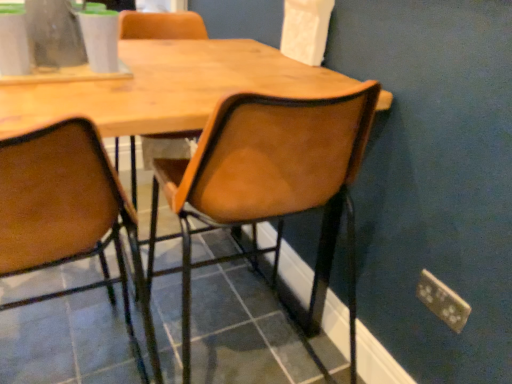
Question: From a real-world perspective, is brown leather chair at center, the second chair positioned from the right, physically above leather-like brown chair at center, which is the 1th chair in right-to-left order?

Choices:
 (A) no
 (B) yes

Answer: (A)

Question: Are brown leather chair at center, which ranks as the first chair in left-to-right order, and leather-like brown chair at center, the second chair viewed from the left, far apart?

Choices:
 (A) no
 (B) yes

Answer: (A)

Question: Is brown leather chair at center, the second chair positioned from the right, positioned before leather-like brown chair at center, which is the 1th chair in right-to-left order?

Choices:
 (A) no
 (B) yes

Answer: (B)

Question: Is brown leather chair at center, which ranks as the first chair in left-to-right order, next to leather-like brown chair at center, which is the 1th chair in right-to-left order?

Choices:
 (A) no
 (B) yes

Answer: (A)

Question: Can you confirm if brown leather chair at center, the second chair positioned from the right, is taller than leather-like brown chair at center, which is the 1th chair in right-to-left order?

Choices:
 (A) yes
 (B) no

Answer: (B)

Question: From a real-world perspective, is brown leather chair at center, the second chair positioned from the right, physically located above or below metallic gold power plugs and sockets at lower right?

Choices:
 (A) below
 (B) above

Answer: (B)

Question: Considering the positions of brown leather chair at center, the second chair positioned from the right, and metallic gold power plugs and sockets at lower right in the image, is brown leather chair at center, the second chair positioned from the right, wider or thinner than metallic gold power plugs and sockets at lower right?

Choices:
 (A) thin
 (B) wide

Answer: (B)

Question: From the image's perspective, is brown leather chair at center, the second chair positioned from the right, positioned above or below metallic gold power plugs and sockets at lower right?

Choices:
 (A) above
 (B) below

Answer: (A)

Question: Is brown leather chair at center, the second chair positioned from the right, to the left or to the right of metallic gold power plugs and sockets at lower right in the image?

Choices:
 (A) right
 (B) left

Answer: (B)

Question: Considering the positions of point (251, 119) and point (64, 62), is point (251, 119) closer or farther from the camera than point (64, 62)?

Choices:
 (A) farther
 (B) closer

Answer: (B)

Question: Considering the relative positions of leather-like brown chair at center, the second chair viewed from the left, and clear glass vase at upper left in the image provided, is leather-like brown chair at center, the second chair viewed from the left, to the left or to the right of clear glass vase at upper left?

Choices:
 (A) right
 (B) left

Answer: (A)

Question: From a real-world perspective, relative to clear glass vase at upper left, is leather-like brown chair at center, the second chair viewed from the left, vertically above or below?

Choices:
 (A) above
 (B) below

Answer: (B)

Question: From their relative heights in the image, would you say leather-like brown chair at center, the second chair viewed from the left, is taller or shorter than clear glass vase at upper left?

Choices:
 (A) tall
 (B) short

Answer: (A)

Question: In terms of width, does leather-like brown chair at center, the second chair viewed from the left, look wider or thinner when compared to brown leather chair at center, which ranks as the first chair in left-to-right order?

Choices:
 (A) thin
 (B) wide

Answer: (A)

Question: Considering their positions, is leather-like brown chair at center, the second chair viewed from the left, located in front of or behind brown leather chair at center, the second chair positioned from the right?

Choices:
 (A) front
 (B) behind

Answer: (B)